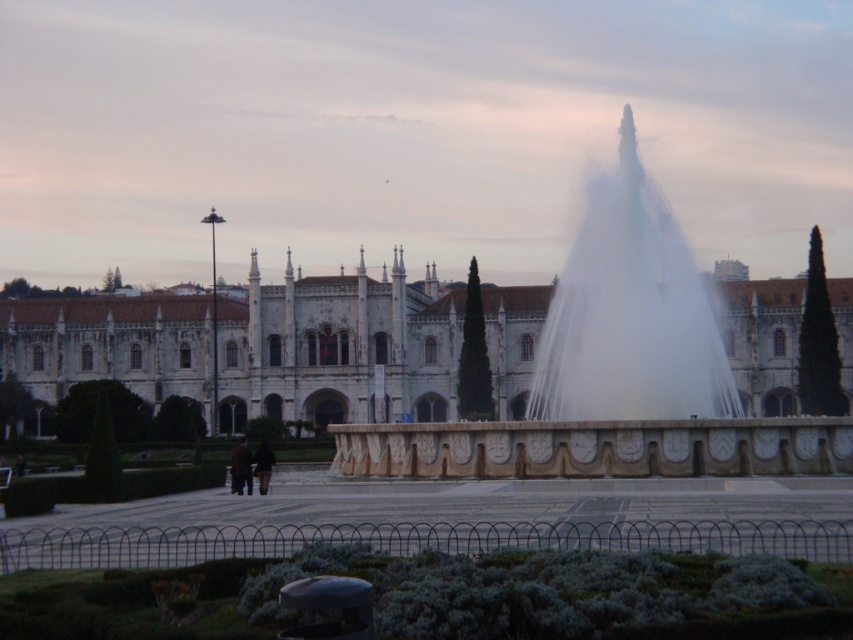
Question: Which point is closer to the camera?

Choices:
 (A) (486, 288)
 (B) (590, 205)

Answer: (B)

Question: Does white stone building at center appear on the right side of white stone fountain at center?

Choices:
 (A) no
 (B) yes

Answer: (A)

Question: Is white stone building at center positioned behind white stone fountain at center?

Choices:
 (A) yes
 (B) no

Answer: (A)

Question: Is white stone building at center positioned behind white stone fountain at center?

Choices:
 (A) no
 (B) yes

Answer: (B)